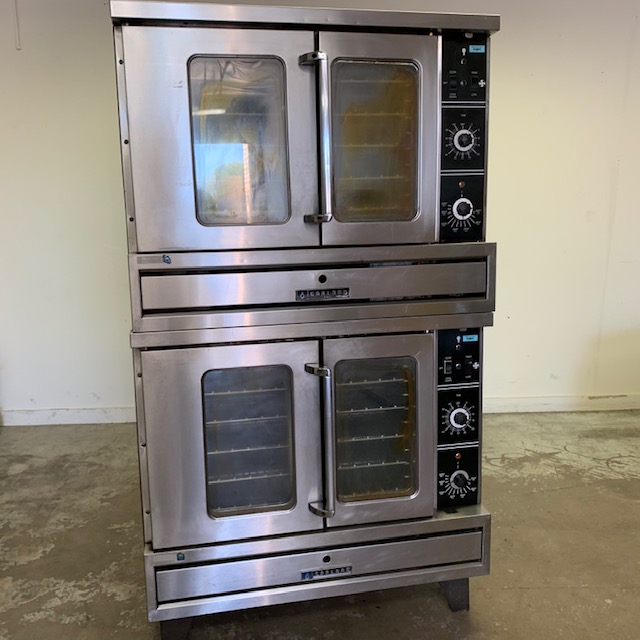
Locate an element on the screen. white painted walls is located at coordinates (534, 265), (83, 315).